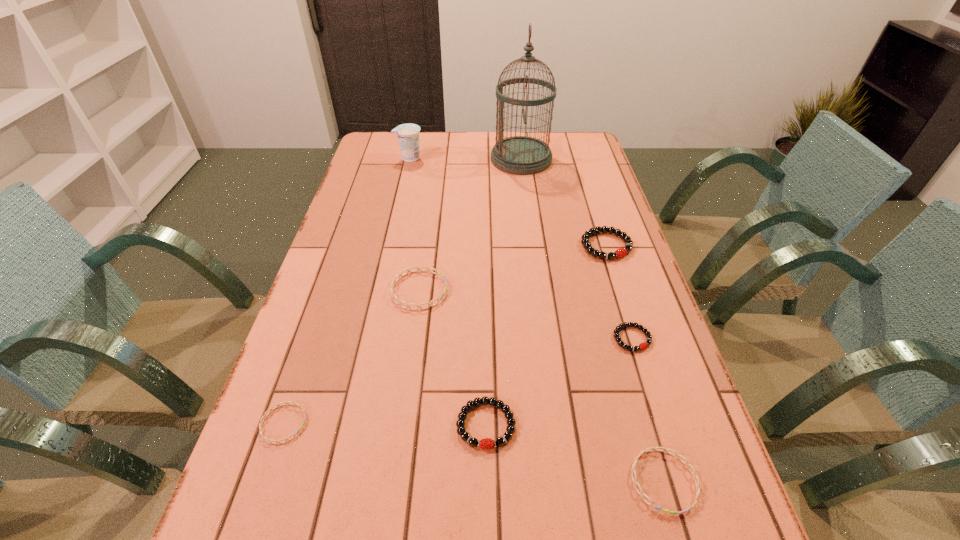
Find the location of `blue bracelet that is the nearest to the third bracelet from left to right`. blue bracelet that is the nearest to the third bracelet from left to right is located at coordinates (666, 450).

The height and width of the screenshot is (540, 960). What are the coordinates of `free location that satisfies the following two spatial constraints: 1. on the front-facing side of the birdcage; 2. on the left side of the third farthest object` in the screenshot? It's located at (533, 246).